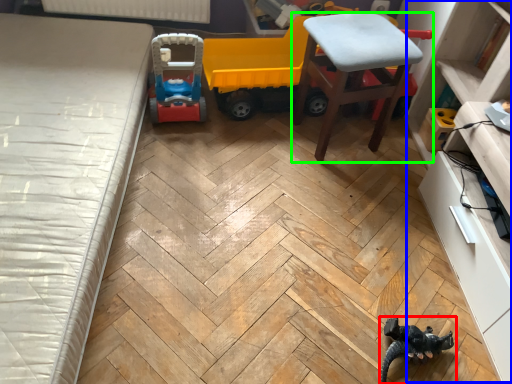
Question: Estimate the real-world distances between objects in this image. Which object is closer to toy (highlighted by a red box), dresser (highlighted by a blue box) or chair (highlighted by a green box)?

Choices:
 (A) dresser
 (B) chair

Answer: (A)